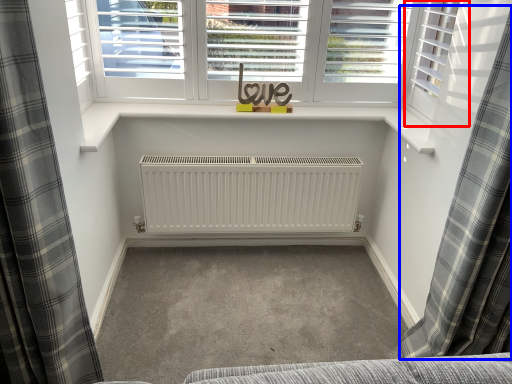
Question: Which of the following is the farthest to the observer, shutter (highlighted by a red box) or curtain (highlighted by a blue box)?

Choices:
 (A) shutter
 (B) curtain

Answer: (A)